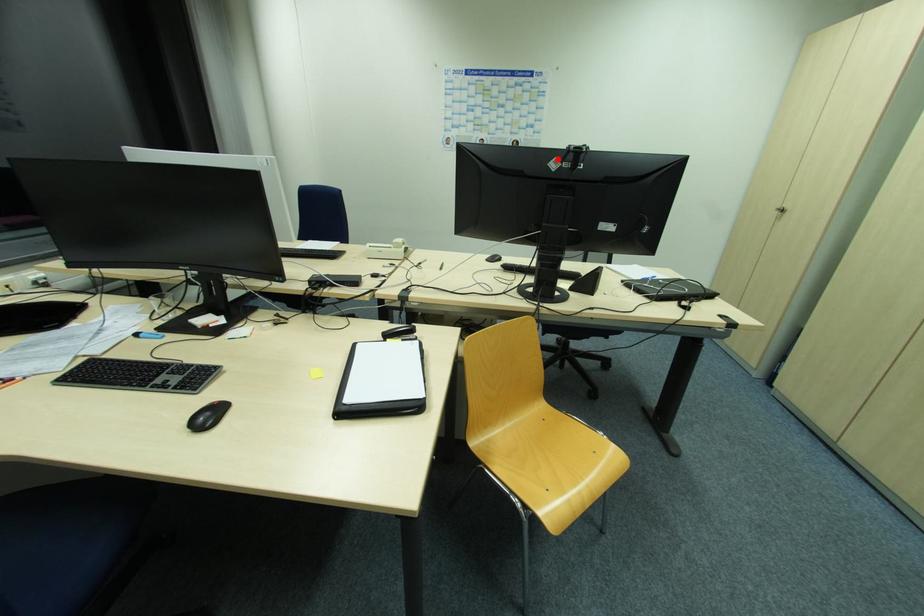
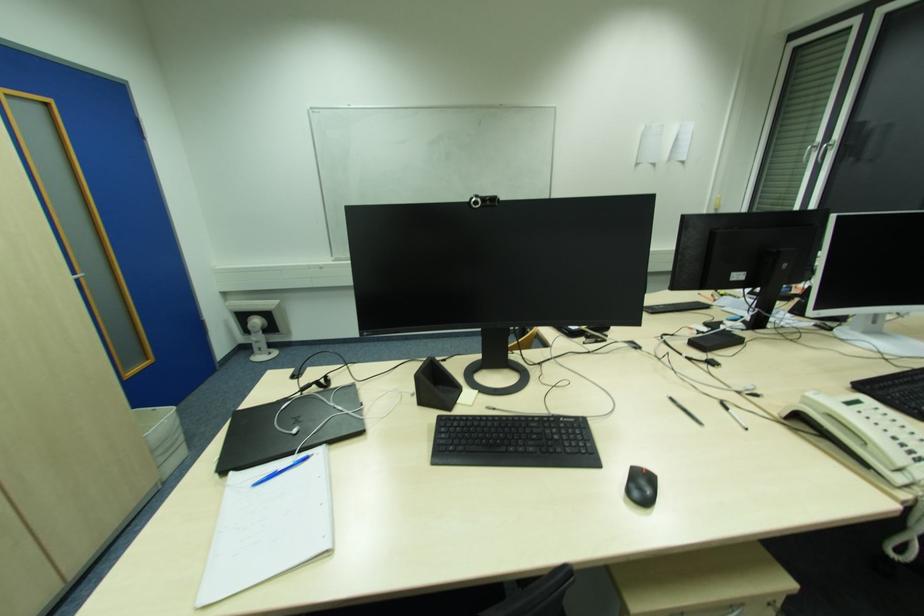
Question: I am providing you with two images of the same scene from different viewpoints. A red point is marked on the first image. Can you still see the location of the red point in image 2?

Choices:
 (A) Yes
 (B) No

Answer: (B)